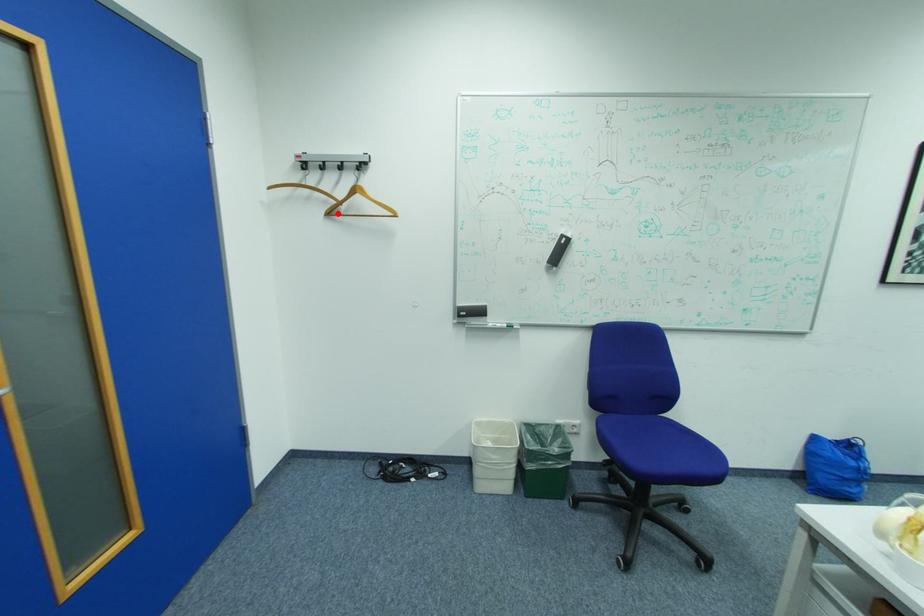
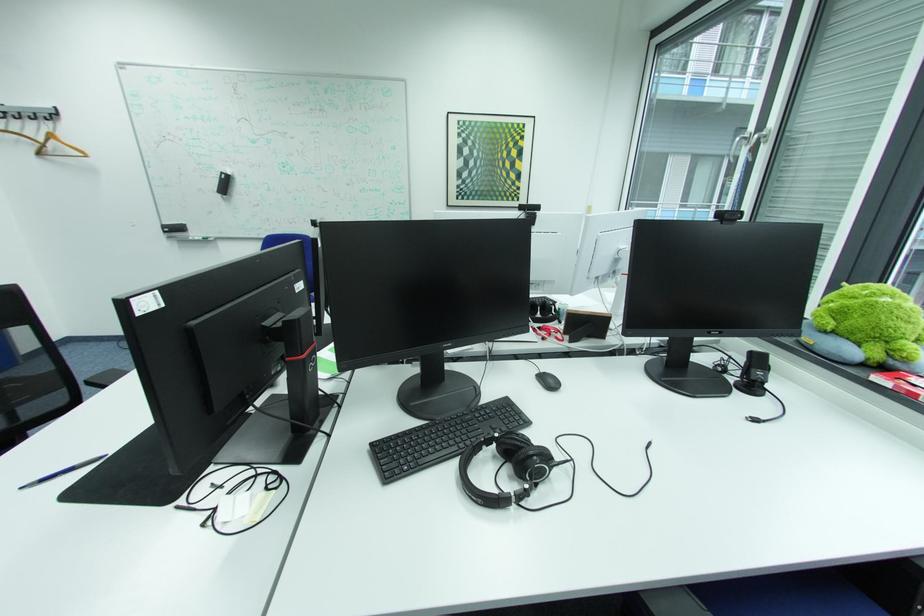
In the second image, find the point that corresponds to the highlighted location in the first image.

(49, 153)